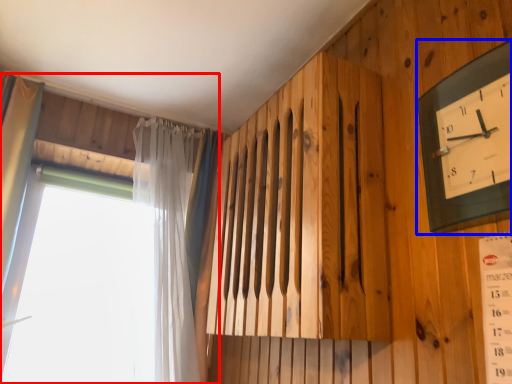
Question: Which object appears farthest to the camera in this image, window (highlighted by a red box) or wall clock (highlighted by a blue box)?

Choices:
 (A) window
 (B) wall clock

Answer: (A)